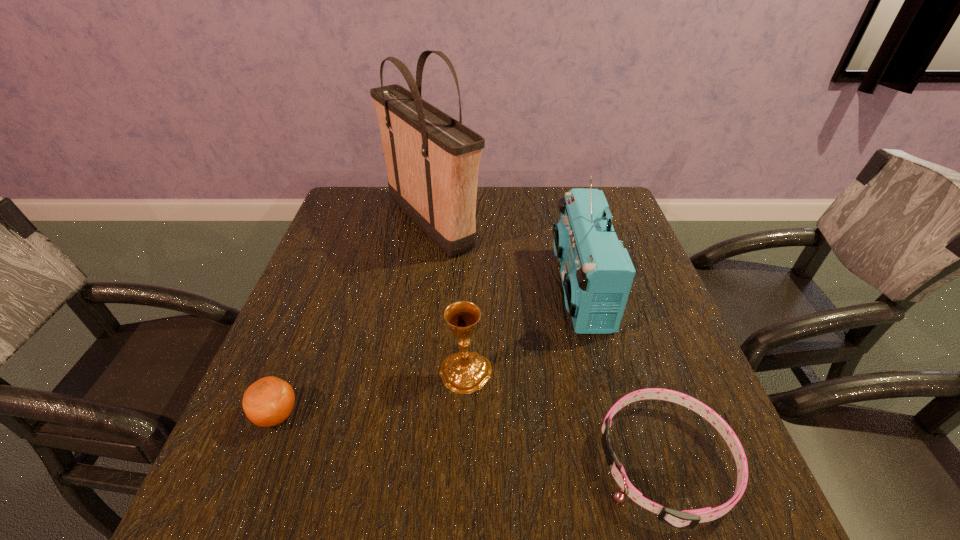
Where is `radio receiver located in the right edge section of the desktop`? radio receiver located in the right edge section of the desktop is located at coordinates (597, 273).

Locate an element on the screen. The height and width of the screenshot is (540, 960). dog collar present at the right edge is located at coordinates 687,519.

You are a GUI agent. You are given a task and a screenshot of the screen. Output one action in this format:
    pyautogui.click(x=<x>, y=<y>)
    Task: Click on the object at the far left corner
    
    Given the screenshot: What is the action you would take?
    pyautogui.click(x=432, y=160)

The width and height of the screenshot is (960, 540). I want to click on object located in the near right corner section of the desktop, so click(687, 519).

At what (x,y) coordinates should I click in order to perform the action: click on free space at the far edge of the desktop. Please return your answer as a coordinate pair (x, y). The height and width of the screenshot is (540, 960). Looking at the image, I should click on (550, 222).

You are a GUI agent. You are given a task and a screenshot of the screen. Output one action in this format:
    pyautogui.click(x=<x>, y=<y>)
    Task: Click on the vacant area at the near edge
    This screenshot has height=540, width=960.
    Given the screenshot: What is the action you would take?
    pyautogui.click(x=349, y=490)

Where is `vacant space at the left edge of the desktop`? This screenshot has height=540, width=960. vacant space at the left edge of the desktop is located at coordinates (298, 307).

Where is `vacant area at the right edge of the desktop`? The height and width of the screenshot is (540, 960). vacant area at the right edge of the desktop is located at coordinates (636, 322).

The image size is (960, 540). In order to click on vacant region at the far left corner of the desktop in this screenshot , I will do `click(331, 217)`.

Where is `free space at the near right corner of the desktop`? The image size is (960, 540). free space at the near right corner of the desktop is located at coordinates (714, 505).